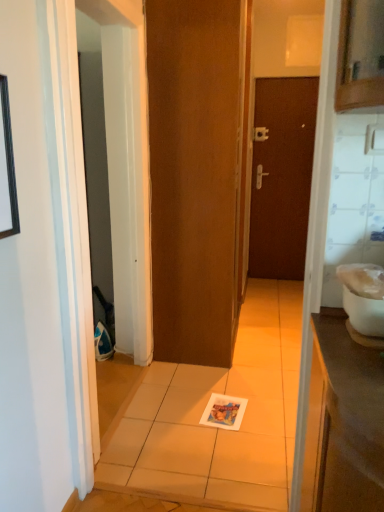
What do you see at coordinates (364, 313) in the screenshot?
I see `white glossy toilet bowl at right` at bounding box center [364, 313].

Image resolution: width=384 pixels, height=512 pixels. What do you see at coordinates (7, 168) in the screenshot?
I see `black matte picture frame at upper left` at bounding box center [7, 168].

Measure the distance between point (258, 188) and camera.

Point (258, 188) and camera are 4.47 meters apart from each other.

The image size is (384, 512). In order to click on silver metallic door handle at center in this screenshot , I will do `click(260, 176)`.

Where is `brown matte door at center, which is the second door from right to left`? The height and width of the screenshot is (512, 384). brown matte door at center, which is the second door from right to left is located at coordinates (197, 174).

At what (x,y) coordinates should I click in order to perform the action: click on matte paper magazine at center. Please return your answer as a coordinate pair (x, y). The width and height of the screenshot is (384, 512). Looking at the image, I should click on (x=224, y=412).

Is matte paper magazine at center turned away from brown matte door at center, placed as the 1th door when sorted from back to front?

No, brown matte door at center, placed as the 1th door when sorted from back to front, is not at the back of matte paper magazine at center.

Which is nearer, (224, 405) or (297, 166)?

Point (224, 405).

Which object is wider, matte paper magazine at center or brown matte door at center, the 2th door in the front-to-back sequence?

With larger width is matte paper magazine at center.

Is matte paper magazine at center touching brown matte door at center, arranged as the second door when viewed from the left?

They are not placed beside each other.

Is silver metallic door handle at center at the back of white glossy toilet bowl at right?

Yes.

Can you confirm if white glossy toilet bowl at right is thinner than silver metallic door handle at center?

In fact, white glossy toilet bowl at right might be wider than silver metallic door handle at center.

Which is in front, point (346, 298) or point (262, 170)?

The point (346, 298) is in front.

Is silver metallic door handle at center located within white glossy toilet bowl at right?

No, silver metallic door handle at center is located outside of white glossy toilet bowl at right.

Is black matte picture frame at upper left shorter than brown matte door at center, placed as the 1th door when sorted from right to left?

Correct, black matte picture frame at upper left is not as tall as brown matte door at center, placed as the 1th door when sorted from right to left.

Looking at this image, which is behind, black matte picture frame at upper left or brown matte door at center, the 2th door in the front-to-back sequence?

brown matte door at center, the 2th door in the front-to-back sequence, is behind.

Which door is the 2nd one when counting from the right side of the black matte picture frame at upper left? Please provide its 2D coordinates.

[(282, 176)]

Can you confirm if black matte picture frame at upper left is positioned to the right of brown matte door at center, arranged as the second door when viewed from the left?

Incorrect, black matte picture frame at upper left is not on the right side of brown matte door at center, arranged as the second door when viewed from the left.

Does white glossy toilet bowl at right have a lesser height compared to matte paper magazine at center?

No.

This screenshot has width=384, height=512. What are the coordinates of `toilet bowl above the matte paper magazine at center (from a real-world perspective)` in the screenshot? It's located at (364, 313).

In the scene shown: Does white glossy toilet bowl at right lie behind matte paper magazine at center?

No, white glossy toilet bowl at right is closer to the viewer.

How much distance is there between white glossy toilet bowl at right and matte paper magazine at center?

white glossy toilet bowl at right and matte paper magazine at center are 1.37 meters apart from each other.

From a real-world perspective, which is physically above, black matte picture frame at upper left or white glossy toilet bowl at right?

black matte picture frame at upper left, from a real-world perspective.

From the image's perspective, who appears lower, black matte picture frame at upper left or white glossy toilet bowl at right?

white glossy toilet bowl at right, from the image's perspective.

Is white glossy toilet bowl at right at the back of black matte picture frame at upper left?

black matte picture frame at upper left does not have its back to white glossy toilet bowl at right.

Does black matte picture frame at upper left have a greater height compared to white glossy toilet bowl at right?

Yes, black matte picture frame at upper left is taller than white glossy toilet bowl at right.

Which object is positioned more to the left, white glossy toilet bowl at right or black matte picture frame at upper left?

From the viewer's perspective, black matte picture frame at upper left appears more on the left side.

From the picture: Is white glossy toilet bowl at right directly adjacent to black matte picture frame at upper left?

No, white glossy toilet bowl at right is not with black matte picture frame at upper left.

How far apart are white glossy toilet bowl at right and black matte picture frame at upper left?

37.84 inches.

From a real-world perspective, is white glossy toilet bowl at right over black matte picture frame at upper left?

No.

Is the surface of brown matte door at center, the first door in the front-to-back sequence, in direct contact with white glossy toilet bowl at right?

They are not placed beside each other.

Can you confirm if brown matte door at center, the 2th door viewed from the back, is positioned to the left of white glossy toilet bowl at right?

Yes.

From the image's perspective, between brown matte door at center, the 2th door viewed from the back, and white glossy toilet bowl at right, which one is located above?

brown matte door at center, the 2th door viewed from the back, is shown above in the image.

From a real-world perspective, between brown matte door at center, the first door positioned from the left, and white glossy toilet bowl at right, who is vertically higher?

From a 3D spatial view, brown matte door at center, the first door positioned from the left, is above.

The image size is (384, 512). Find the location of `the 1st door directly above the matte paper magazine at center (from a real-world perspective)`. the 1st door directly above the matte paper magazine at center (from a real-world perspective) is located at coordinates (282, 176).

This screenshot has height=512, width=384. Identify the location of toilet bowl located underneath the silver metallic door handle at center (from a real-world perspective). (364, 313).

Considering their positions, is matte paper magazine at center positioned further to black matte picture frame at upper left than white glossy toilet bowl at right?

matte paper magazine at center is further to black matte picture frame at upper left.

Looking at the image, which one is located closer to brown matte door at center, placed as the 1th door when sorted from right to left, silver metallic door handle at center or white glossy toilet bowl at right?

silver metallic door handle at center is closer to brown matte door at center, placed as the 1th door when sorted from right to left.

Based on their spatial positions, is black matte picture frame at upper left or white glossy toilet bowl at right further from brown matte door at center, the first door positioned from the left?

white glossy toilet bowl at right.

Looking at this image, considering their positions, is white glossy toilet bowl at right positioned further to brown matte door at center, the first door in the front-to-back sequence, than silver metallic door handle at center?

silver metallic door handle at center is further to brown matte door at center, the first door in the front-to-back sequence.

Based on their spatial positions, is black matte picture frame at upper left or brown matte door at center, the 2th door viewed from the back, further from white glossy toilet bowl at right?

The object further to white glossy toilet bowl at right is brown matte door at center, the 2th door viewed from the back.

Looking at the image, which one is located further to black matte picture frame at upper left, matte paper magazine at center or silver metallic door handle at center?

silver metallic door handle at center.

Based on their spatial positions, is white glossy toilet bowl at right or matte paper magazine at center closer to black matte picture frame at upper left?

Among the two, white glossy toilet bowl at right is located nearer to black matte picture frame at upper left.

Considering their positions, is silver metallic door handle at center positioned closer to black matte picture frame at upper left than brown matte door at center, which is the second door from right to left?

brown matte door at center, which is the second door from right to left, is positioned closer to the anchor black matte picture frame at upper left.

The height and width of the screenshot is (512, 384). I want to click on door between black matte picture frame at upper left and brown matte door at center, the 2th door in the front-to-back sequence, in the front-back direction, so click(197, 174).

At what (x,y) coordinates should I click in order to perform the action: click on magazine between white glossy toilet bowl at right and brown matte door at center, placed as the 1th door when sorted from back to front, along the z-axis. Please return your answer as a coordinate pair (x, y). The height and width of the screenshot is (512, 384). Looking at the image, I should click on point(224,412).

You are a GUI agent. You are given a task and a screenshot of the screen. Output one action in this format:
    pyautogui.click(x=<x>, y=<y>)
    Task: Click on the magazine between white glossy toilet bowl at right and brown matte door at center, which is the second door from right to left, from front to back
    This screenshot has width=384, height=512.
    Given the screenshot: What is the action you would take?
    coord(224,412)

Find the location of a particular element. This screenshot has height=512, width=384. door between white glossy toilet bowl at right and brown matte door at center, placed as the 1th door when sorted from back to front, in the front-back direction is located at coordinates (197, 174).